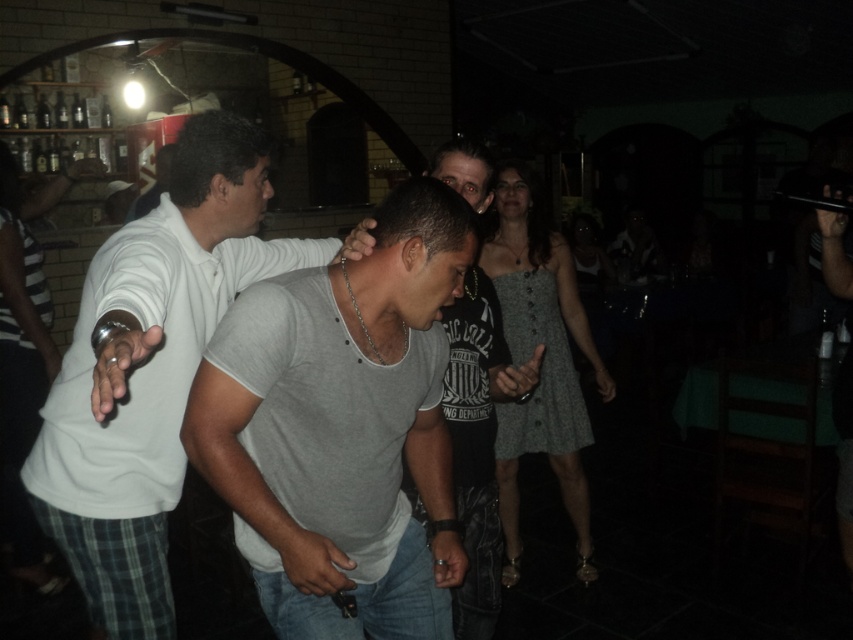
Consider the image. You are a dancer in a crowded bar. You see a gray cotton shirt at center and a man in a white shirt and plaid shorts at lower right. Which one is closer to you?

The gray cotton shirt at center is closer to you than the man in a white shirt and plaid shorts at lower right because they are 1.35 meters apart.